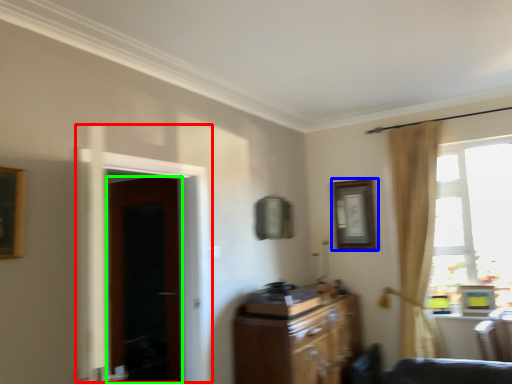
Question: Considering the real-world distances, which object is closest to screen door (highlighted by a red box)? picture frame (highlighted by a blue box) or door (highlighted by a green box).

Choices:
 (A) picture frame
 (B) door

Answer: (B)